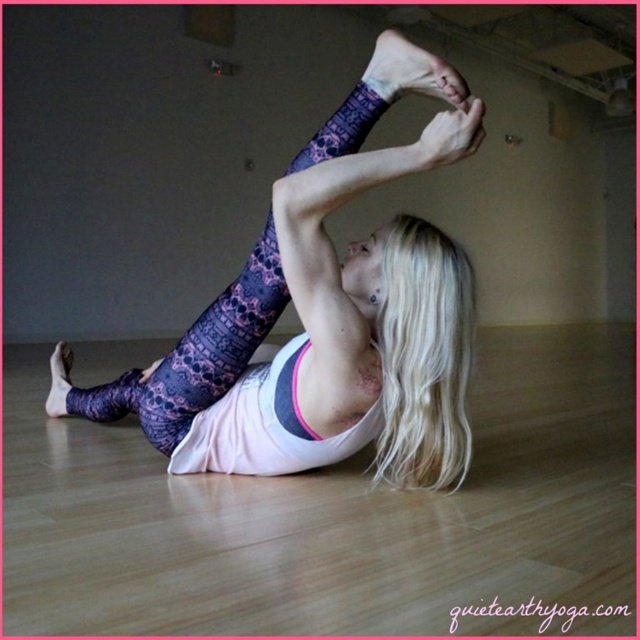
Question: Which point appears closest to the camera in this image?

Choices:
 (A) (385, 177)
 (B) (138, 385)

Answer: (A)

Question: Can you confirm if purple printed leggings at center is thinner than purple printed sock at lower left?

Choices:
 (A) yes
 (B) no

Answer: (B)

Question: Is purple printed leggings at center below purple printed sock at lower left?

Choices:
 (A) yes
 (B) no

Answer: (B)

Question: Which of the following is the closest to the observer?

Choices:
 (A) purple printed leggings at center
 (B) purple printed sock at lower left

Answer: (A)

Question: Is purple printed leggings at center to the right of purple printed sock at lower left from the viewer's perspective?

Choices:
 (A) yes
 (B) no

Answer: (A)